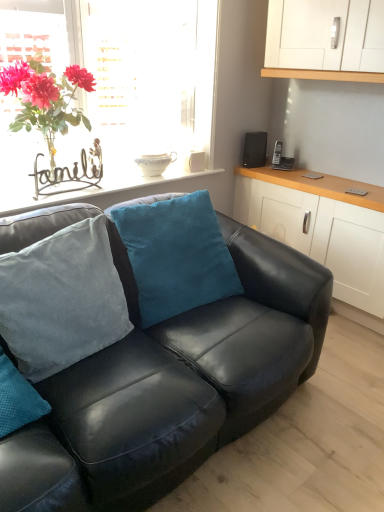
Find the location of a particular element. This screenshot has width=384, height=512. vacant space to the right of black matte speaker at upper right is located at coordinates (282, 165).